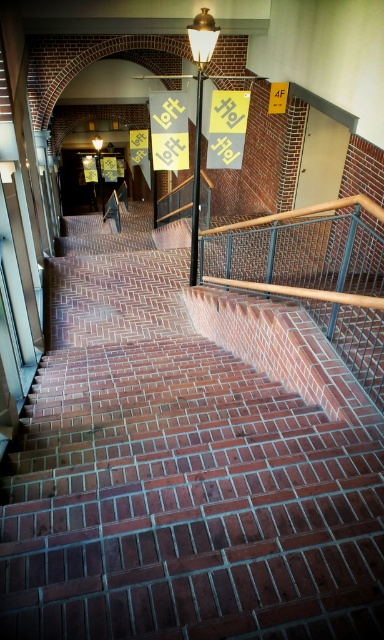
Question: Is brick stairs at center to the right of yellow paper sign at left from the viewer's perspective?

Choices:
 (A) no
 (B) yes

Answer: (A)

Question: Is brown metal/rail at center further to the viewer compared to yellow paper sign at center?

Choices:
 (A) yes
 (B) no

Answer: (A)

Question: Estimate the real-world distances between objects in this image. Which object is closer to the yellow paper sign at left?

Choices:
 (A) yellow paper sign at center
 (B) brick stairs at center

Answer: (A)

Question: Among these objects, which one is farthest from the camera?

Choices:
 (A) brick stairs at center
 (B) yellow paper sign at left
 (C) brown metal/rail at center

Answer: (C)

Question: Which of these objects is positioned farthest from the brick stairs at center?

Choices:
 (A) yellow paper sign at left
 (B) yellow paper sign at center
 (C) brown metal/rail at center

Answer: (C)

Question: Is the position of brick stairs at center less distant than that of yellow paper sign at left?

Choices:
 (A) no
 (B) yes

Answer: (B)